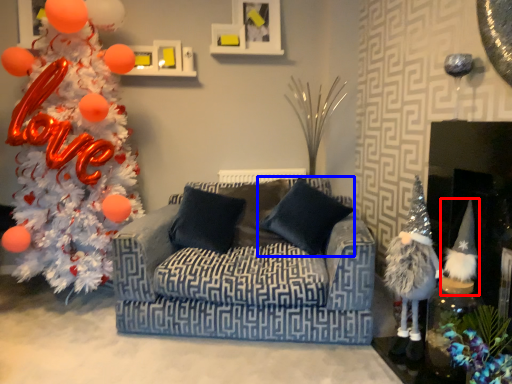
Question: Which object is further to the camera taking this photo, toy (highlighted by a red box) or pillow (highlighted by a blue box)?

Choices:
 (A) toy
 (B) pillow

Answer: (B)